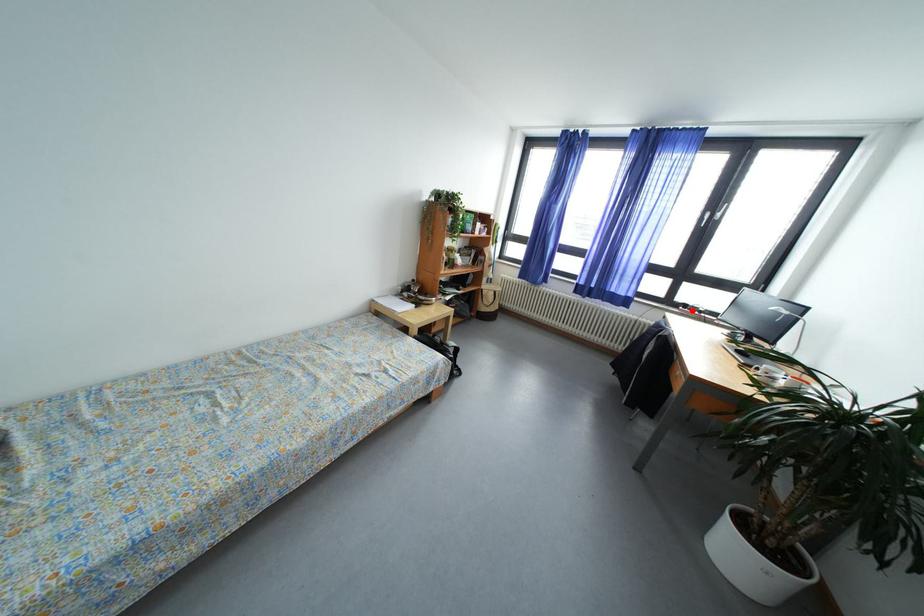
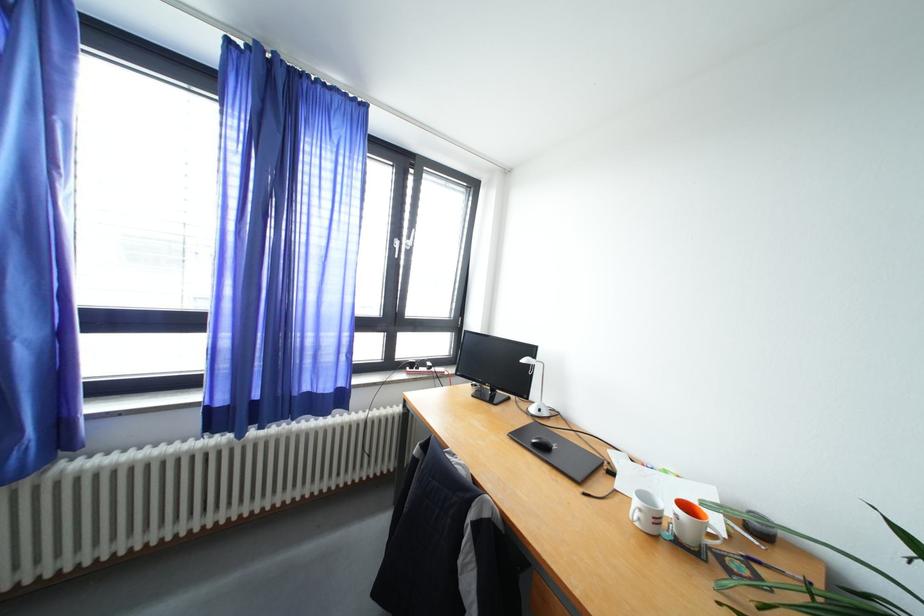
In the second image, find the point that corresponds to the highlighted location in the first image.

(419, 370)